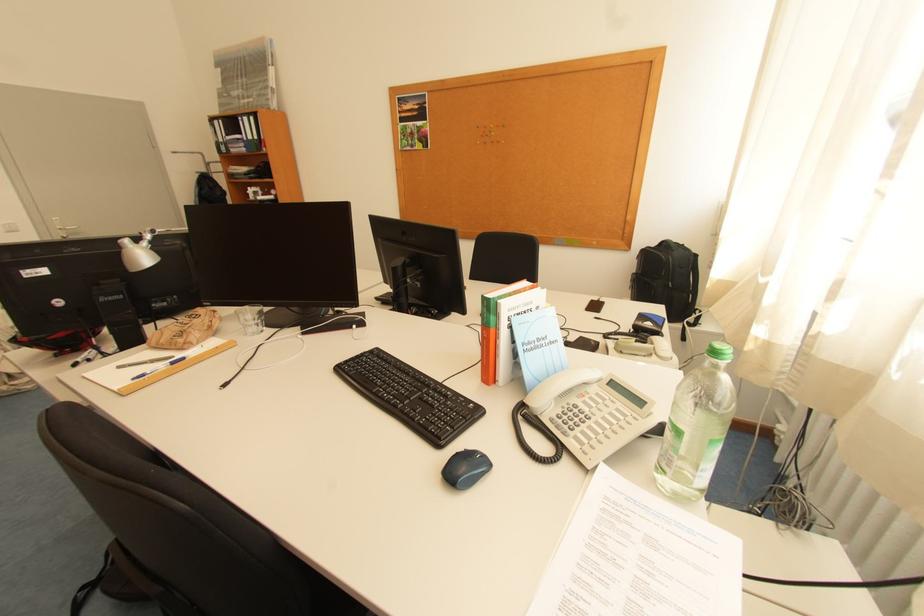
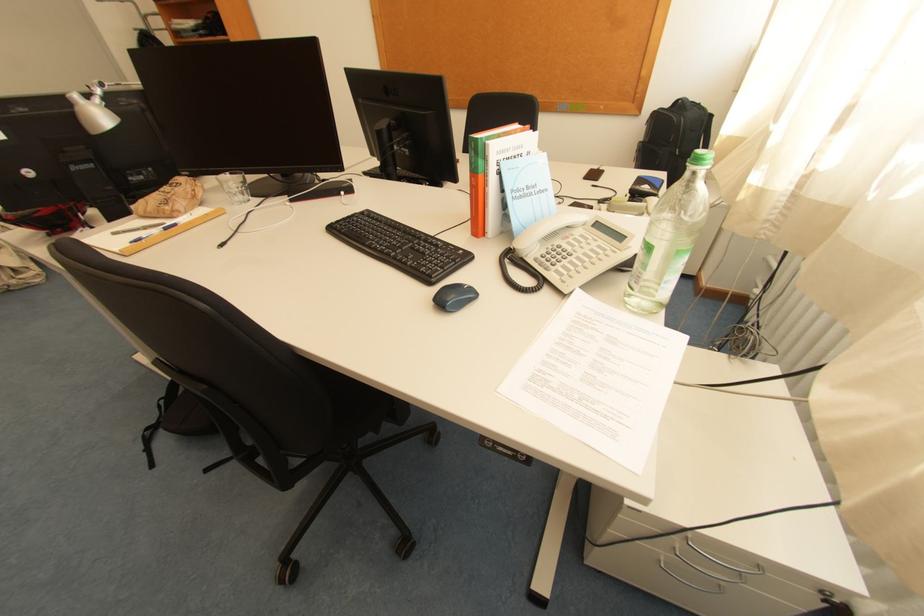
Find the pixel in the second image that matches pixel 365 358 in the first image.

(356, 219)